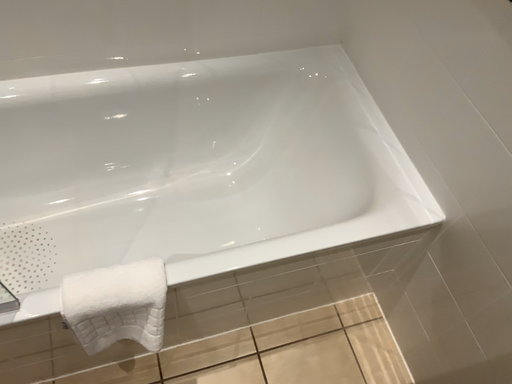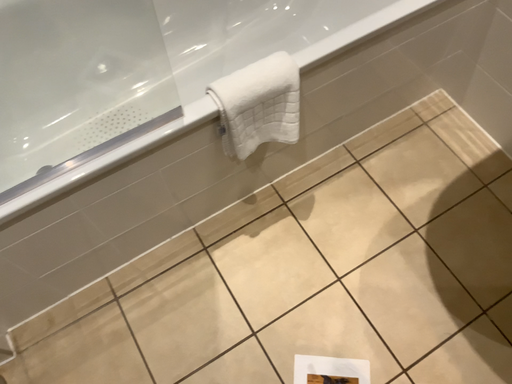
Question: Which way did the camera rotate in the video?

Choices:
 (A) rotated upward
 (B) rotated downward

Answer: (B)